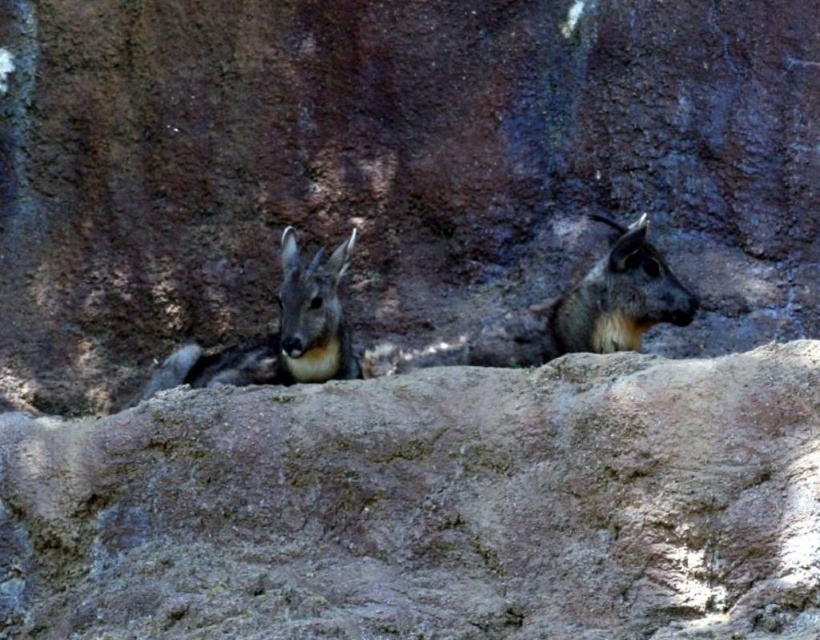
You are a photographer trying to capture the two points in the image. Which point, point (x=248, y=380) or point (x=673, y=280), is closer to your camera?

Point (x=248, y=380) is closer to the camera than point (x=673, y=280) because it is further to the camera than the other point.

You are a photographer trying to capture a clear shot of the brown fur goat at center. However, there is a brown rough rock at center in the way. Can you determine if the goat is visible from your current position?

The brown rough rock at center is positioned under the brown fur goat at center, so the goat is partially visible from your current position as the rock is beneath it.

You are a hiker who wants to place a 20 inch long backpack between the brown rough rock at center and the brown fur goat at center. Is there enough space for the backpack?

The distance between the brown rough rock at center and the brown fur goat at center is 21.70 inches, so yes, the backpack can fit between them since it is shorter than the available space.